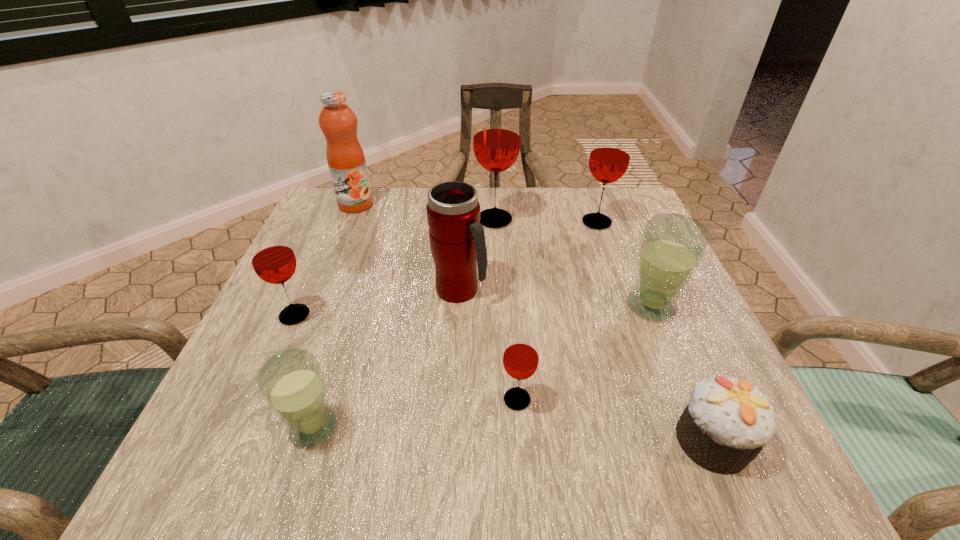
Where is `fruit juice`? fruit juice is located at coordinates (346, 161).

Identify the location of the biggest red glass. The image size is (960, 540). (496, 142).

The width and height of the screenshot is (960, 540). In order to click on the rightmost red glass in this screenshot , I will do `click(610, 154)`.

Locate an element on the screen. The height and width of the screenshot is (540, 960). the second tallest glass is located at coordinates (610, 154).

Where is `thermos bottle`? The image size is (960, 540). thermos bottle is located at coordinates (457, 240).

Where is `the leftmost red glass`? The height and width of the screenshot is (540, 960). the leftmost red glass is located at coordinates (272, 257).

The width and height of the screenshot is (960, 540). I want to click on the second smallest red glass, so click(272, 257).

Where is `the bigger blue glass`? The width and height of the screenshot is (960, 540). the bigger blue glass is located at coordinates (672, 245).

In order to click on the farther blue glass in this screenshot , I will do `click(672, 245)`.

At what (x,y) coordinates should I click in order to perform the action: click on the smallest red glass. Please return your answer as a coordinate pair (x, y). Looking at the image, I should click on (520, 359).